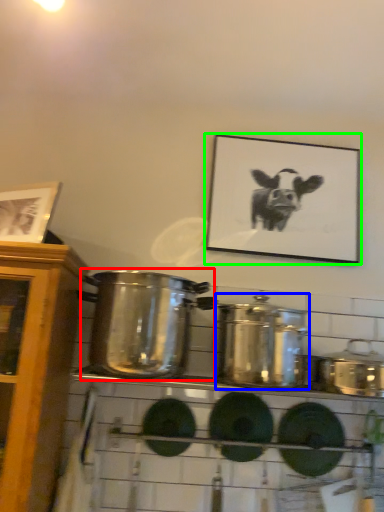
Question: Based on their relative distances, which object is farther from crock pot (highlighted by a red box)? Choose from crock pot (highlighted by a blue box) and picture frame (highlighted by a green box).

Choices:
 (A) crock pot
 (B) picture frame

Answer: (B)